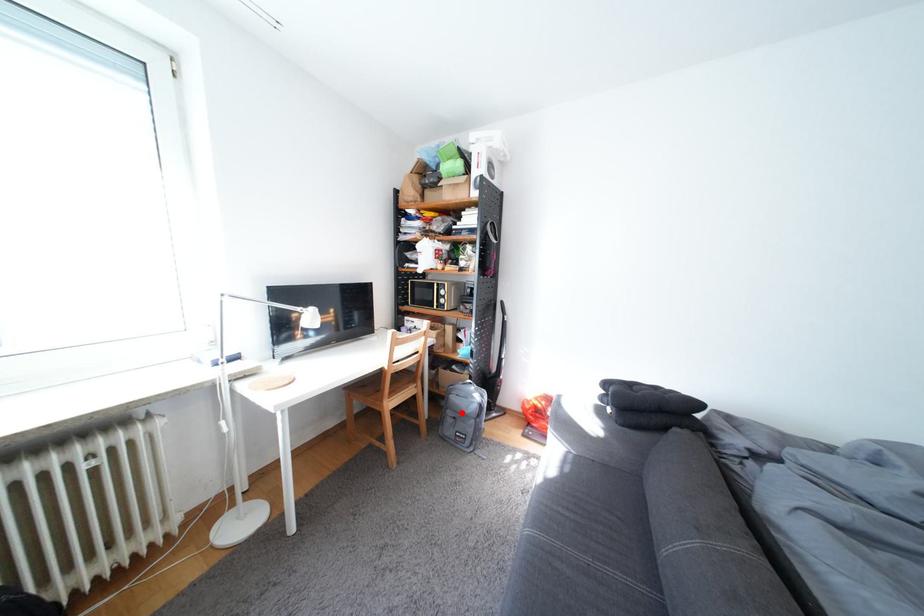
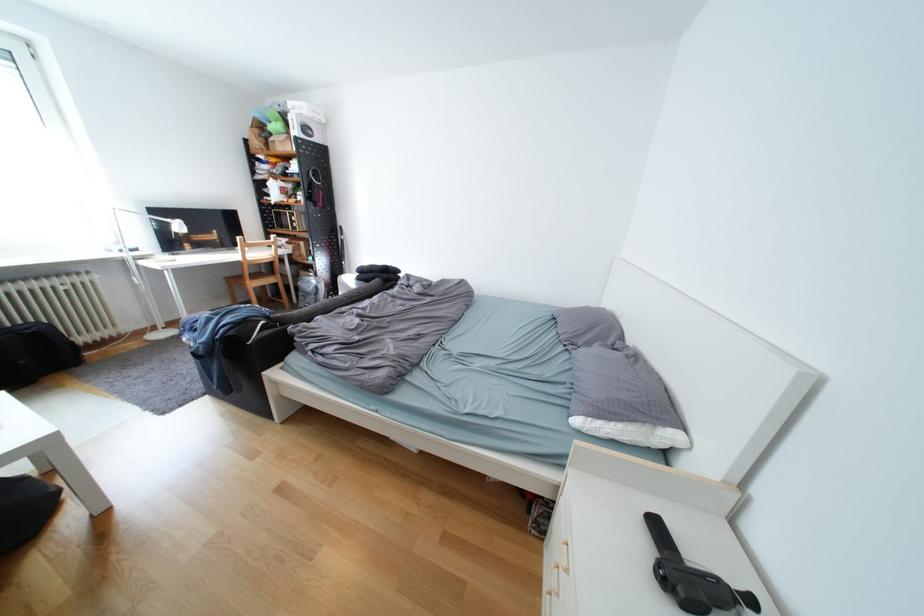
Locate, in the second image, the point that corresponds to the highlighted location in the first image.

(313, 294)